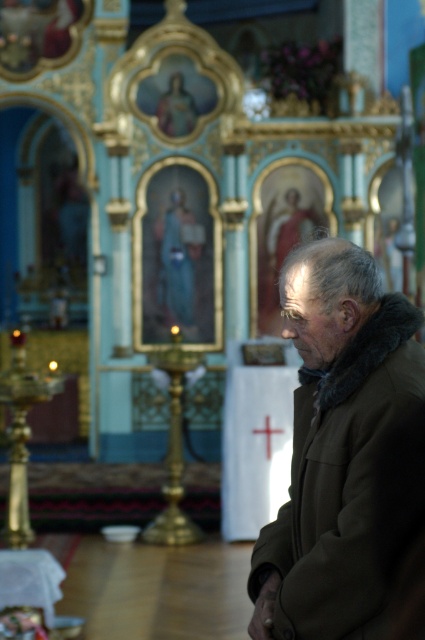
You are standing at the point marked as point (317,378) in the church. The iconostasis is directly in front of you. If you walk straight ahead, will you reach the iconostasis before the elderly man in the brown coat with a fur lined hood?

The distance between you and the iconostasis is 39.08 meters, so you will reach the iconostasis before the elderly man in the brown coat with a fur lined hood because you are closer to it.